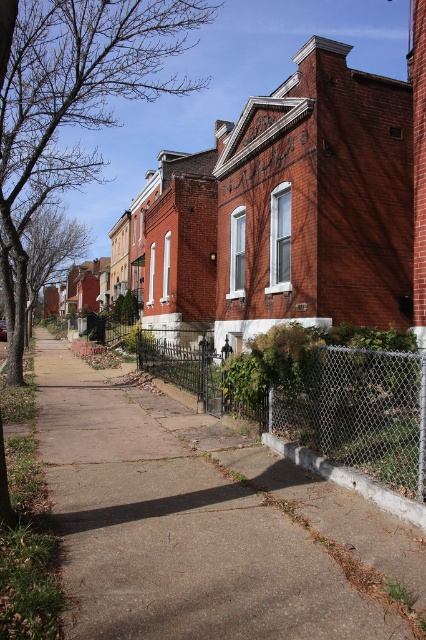
Does concrete sidewalk at center have a lesser width compared to chain-link fence at center?

Correct, concrete sidewalk at center's width is less than chain-link fence at center's.

Which is more to the right, concrete sidewalk at center or chain-link fence at center?

From the viewer's perspective, chain-link fence at center appears more on the right side.

Measure the distance between concrete sidewalk at center and camera.

The distance of concrete sidewalk at center from camera is 9.77 feet.

This screenshot has height=640, width=426. In order to click on concrete sidewalk at center in this screenshot , I will do `click(201, 522)`.